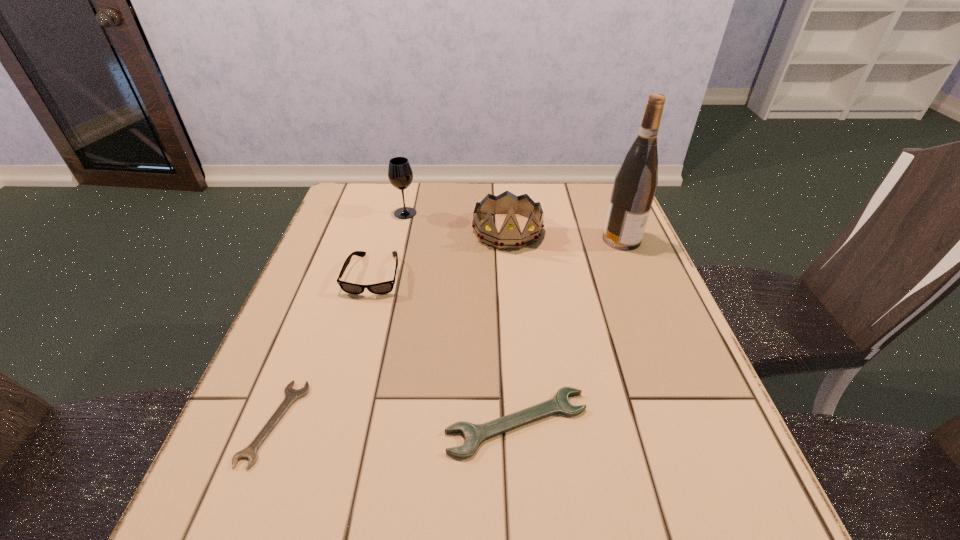
Locate an element on the screen. The width and height of the screenshot is (960, 540). object that is positioned at the right edge is located at coordinates (635, 183).

In the image, there is a desktop. Identify the location of free space at the far edge. (553, 187).

Locate an element on the screen. vacant space at the near edge of the desktop is located at coordinates (339, 506).

This screenshot has width=960, height=540. In the image, there is a desktop. Find the location of `vacant space at the left edge`. vacant space at the left edge is located at coordinates (350, 351).

The width and height of the screenshot is (960, 540). Identify the location of vacant area at the right edge of the desktop. (600, 231).

Where is `free space at the far left corner`? free space at the far left corner is located at coordinates (365, 223).

In order to click on empty location between the shorter wrench and the rightmost object in this screenshot , I will do `click(447, 331)`.

Image resolution: width=960 pixels, height=540 pixels. In order to click on free space between the shortest object and the second shortest object in this screenshot , I will do `click(396, 423)`.

This screenshot has width=960, height=540. I want to click on free space between the left wrench and the rightmost object, so click(x=447, y=331).

The height and width of the screenshot is (540, 960). I want to click on free point between the shortest object and the tiara, so click(391, 327).